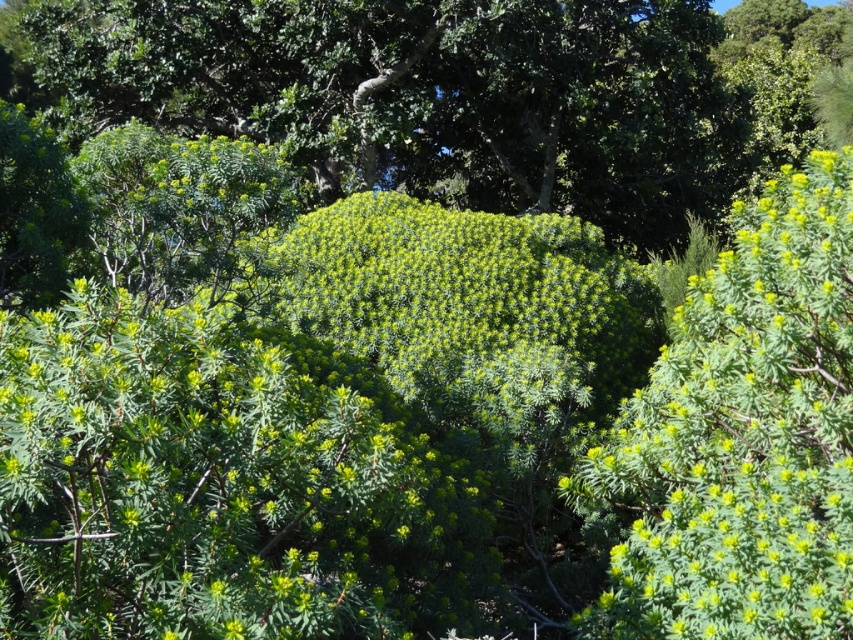
You are standing at point A and want to walk to point B in the landscape. The coordinates for point A are point (238, 13) and point B are point (677, 364). According to the image, which direction should you walk to reach point B from point A?

Since point (238, 13) is behind point (677, 364), you should walk forward towards point B to reach it from point A.

You are standing in the lush landscape and want to take a photo of the green leafy bush at center and the green fuzzy bush at upper right. Which bush should you focus on first if you want to capture both in the same frame without moving the camera?

You should focus on the green leafy bush at center first because it is positioned to the left of the green fuzzy bush at upper right, so adjusting the camera to include both would require ensuring the left side is framed properly first.

You are standing in the lush green landscape described. You see a point marked at coordinates (426, 96). What does this point correspond to?

The point at coordinates (426, 96) corresponds to the green leafy bush at center as described in the scene.